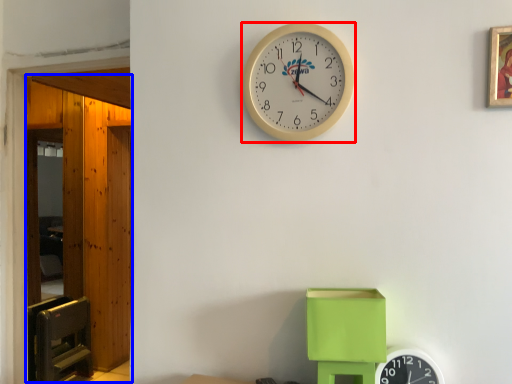
Question: Among these objects, which one is farthest to the camera, wall clock (highlighted by a red box) or glass door (highlighted by a blue box)?

Choices:
 (A) wall clock
 (B) glass door

Answer: (B)